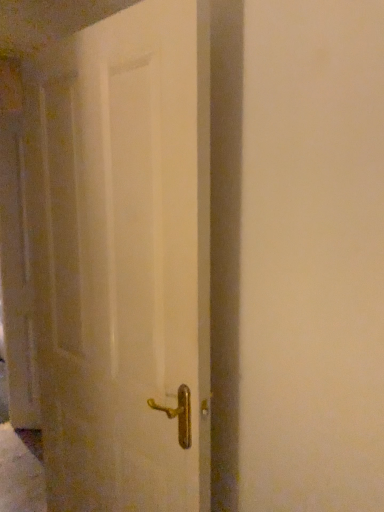
What do you see at coordinates (126, 262) in the screenshot?
I see `white matte door at center` at bounding box center [126, 262].

What is the approximate width of white matte door at center?

The width of white matte door at center is 16.51 centimeters.

Consider the image. In order to face white matte door at center, should I rotate leftwards or rightwards?

To align with it, rotate left about 11.725°.

The height and width of the screenshot is (512, 384). Identify the location of white matte door at center. (126, 262).

Locate an element on the screen. The width and height of the screenshot is (384, 512). white matte door at center is located at coordinates (126, 262).